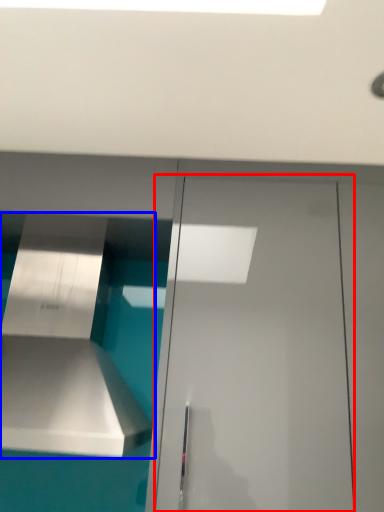
Question: Which object appears closest to the camera in this image, door (highlighted by a red box) or vent (highlighted by a blue box)?

Choices:
 (A) door
 (B) vent

Answer: (B)